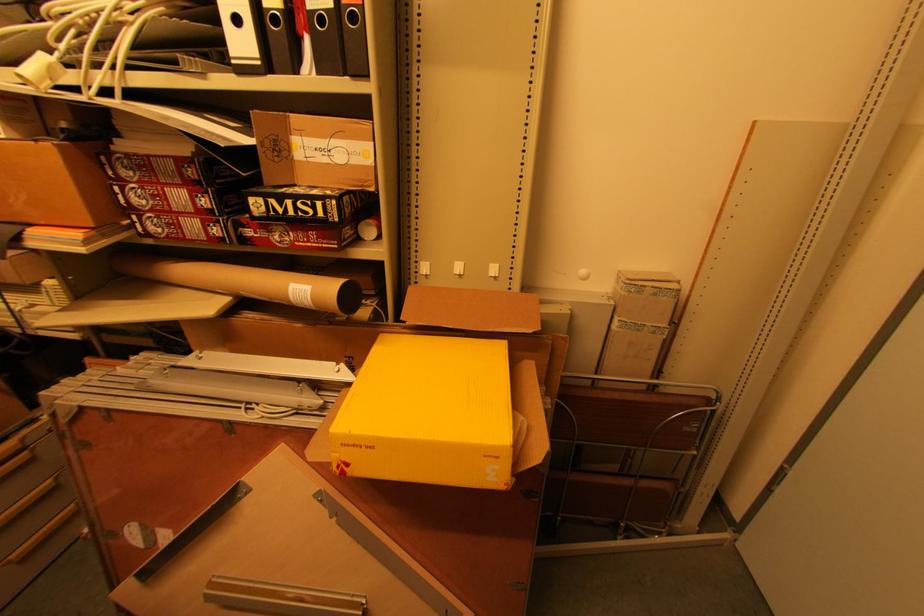
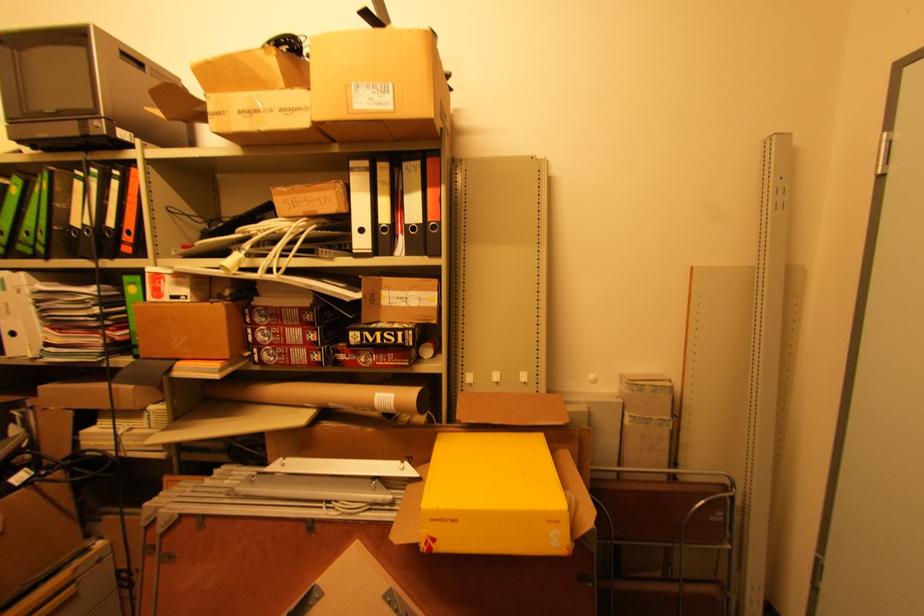
Locate, in the second image, the point that corresponds to point (310, 302) in the first image.

(392, 408)